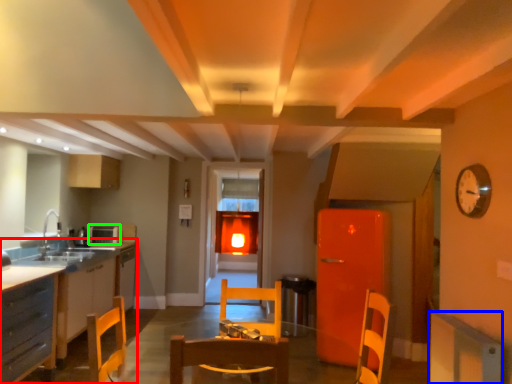
Question: Which object is positioned closest to countertop (highlighted by a red box)? Select from cabinetry (highlighted by a blue box) and appliance (highlighted by a green box).

Choices:
 (A) cabinetry
 (B) appliance

Answer: (B)